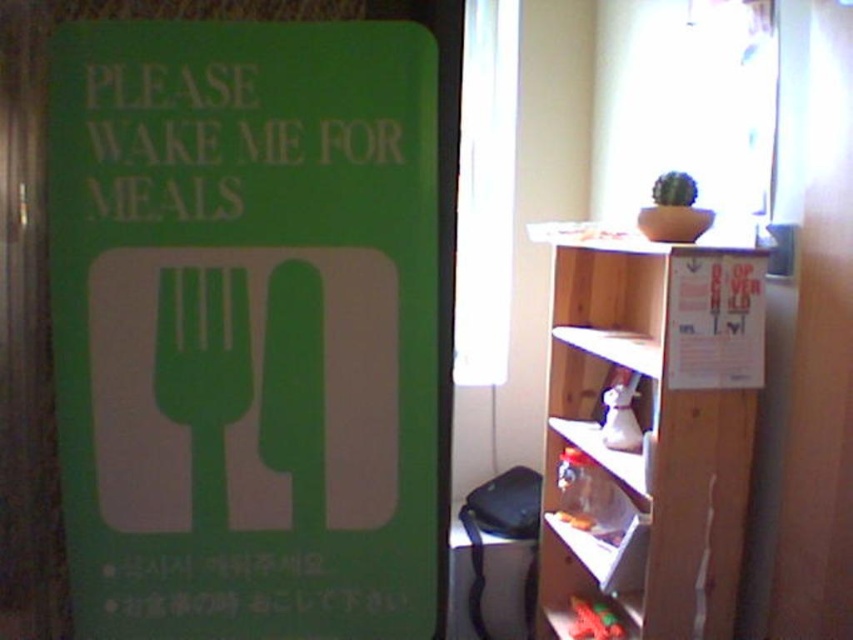
You are organizing a room and need to place two green matte signs. The scene shows a green matte sign at left and a green matte sign at upper left. Which one is bigger?

The green matte sign at left is larger in size than the green matte sign at upper left.

You are a guest in this room and want to read the text on the green matte sign at upper left and the green matte fork at left. Which one is higher up?

The green matte sign at upper left is above the green matte fork at left, so it is higher up.